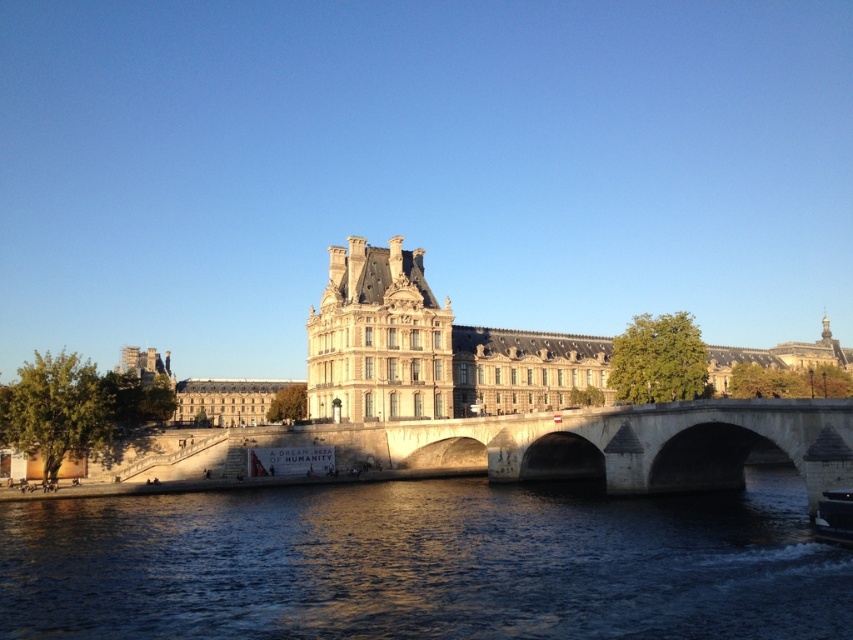
You are standing at the point closest to the camera in the scene and want to walk to the point further away. Which of the two points, point [138,596] or point [469,339], should you head towards?

You should head towards point [469,339] because it is further away from the camera compared to point [138,596].

You are a tourist standing on the stone bridge and want to take a photo of the beige stone palace at center and the dark blue water at center. Which object should you focus on first if you want to capture both in a single frame without moving the camera?

You should focus on the beige stone palace at center first because it is wider than the dark blue water at center, so it will fit better in the frame.